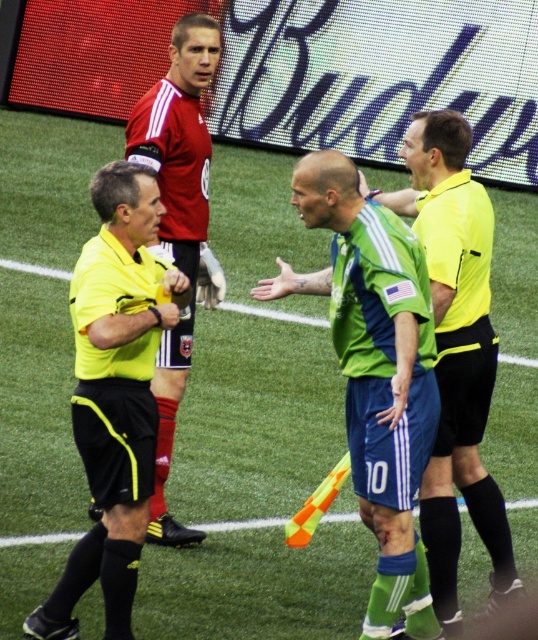
You are a GUI agent. You are given a task and a screenshot of the screen. Output one action in this format:
    pyautogui.click(x=<x>, y=<y>)
    Task: Click on the green matte jersey at center
    The image size is (538, 640).
    Given the screenshot: What is the action you would take?
    pyautogui.click(x=374, y=369)

Between green matte jersey at center and yellow/black uniform at left, which one has more height?

green matte jersey at center is taller.

Which is behind, point (387, 538) or point (116, 336)?

The point (387, 538) is behind.

I want to click on green matte jersey at center, so click(x=374, y=369).

Describe the element at coordinates (115, 394) in the screenshot. I see `yellow/black uniform at left` at that location.

Does point (147, 416) come in front of point (443, 256)?

Yes, it is in front of point (443, 256).

Measure the distance between yellow/black uniform at left and camera.

The distance of yellow/black uniform at left from camera is 5.90 meters.

The height and width of the screenshot is (640, 538). I want to click on yellow/black uniform at left, so click(x=115, y=394).

Can you confirm if yellow/black uniform at center is smaller than matte red jersey at upper center?

No.

Does yellow/black uniform at center have a lesser height compared to matte red jersey at upper center?

Correct, yellow/black uniform at center is not as tall as matte red jersey at upper center.

Between point (462, 333) and point (203, 177), which one is positioned behind?

The point (203, 177) is more distant.

The width and height of the screenshot is (538, 640). I want to click on yellow/black uniform at center, so click(x=456, y=353).